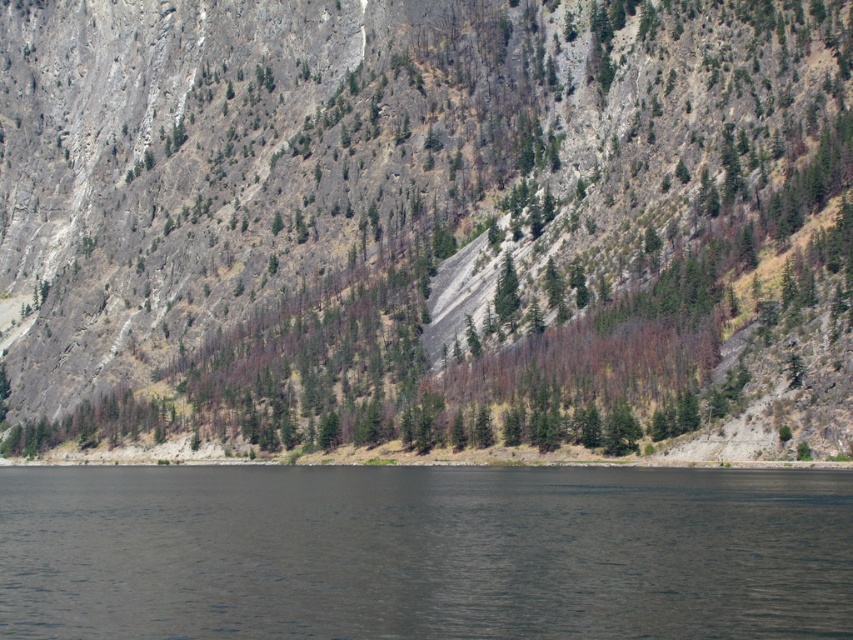
In the scene shown: Between rocky cliff at center and dark gray water at lower center, which one has less height?

Standing shorter between the two is dark gray water at lower center.

Is point (264, 83) positioned behind point (494, 595)?

Yes.

You are a GUI agent. You are given a task and a screenshot of the screen. Output one action in this format:
    pyautogui.click(x=<x>, y=<y>)
    Task: Click on the rocky cliff at center
    Image resolution: width=853 pixels, height=640 pixels.
    Given the screenshot: What is the action you would take?
    pyautogui.click(x=422, y=218)